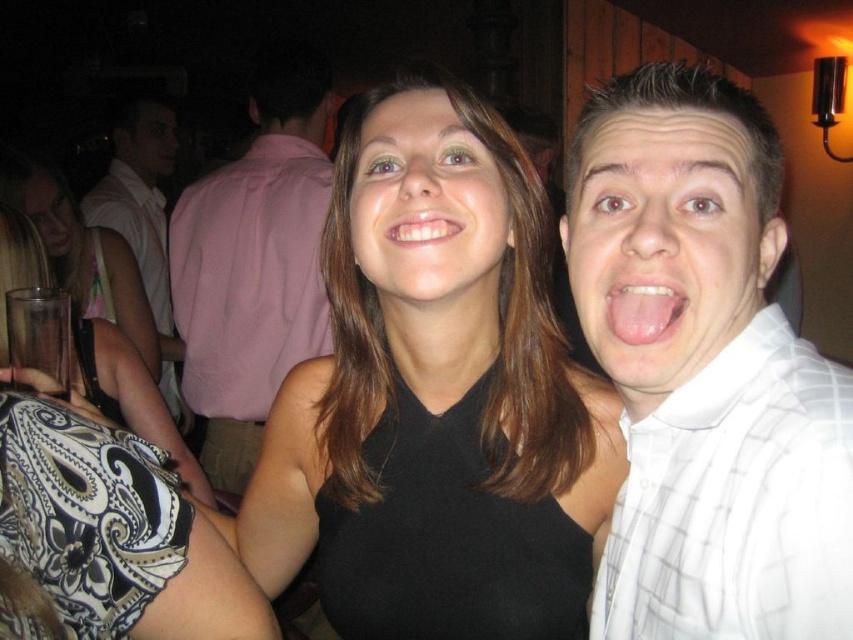
You are at a party and want to know which object is wider between the clear plastic cup at left and the white glossy teeth at center. Can you determine this based on the scene?

The clear plastic cup at left is wider than the white glossy teeth at center, as stated in the description.

You are a photographer at this event and want to ensure both the black matte dress at center and the black matte face at center are clearly visible in your photo. Based on their positions, which one should you focus on first to ensure it is in sharp focus?

The black matte face at center should be focused on first since it is above the black matte dress at center, making it closer to the camera. This ensures the face is in focus, and the dress, being below, will also be in focus if the depth of field is sufficient.

You are a photographer adjusting your camera settings to capture the scene. You notice the white shirt at left and the matte black face at upper left in your viewfinder. Which object should you focus on to ensure proper exposure, considering their sizes and the lighting conditions?

The white shirt at left is bigger than the matte black face at upper left, so focusing on the white shirt at left would be better for proper exposure as larger objects often provide more accurate metering in lighting conditions.